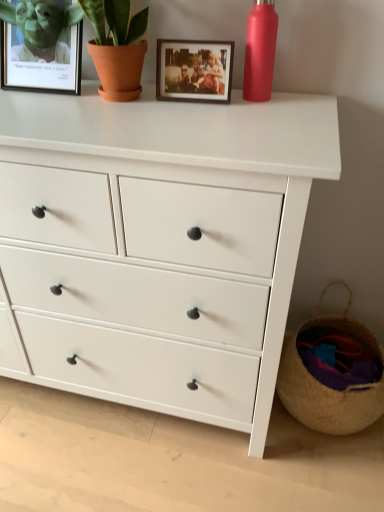
Find the location of a particular element. vacant area that is in front of matte red bottle at upper right is located at coordinates (261, 114).